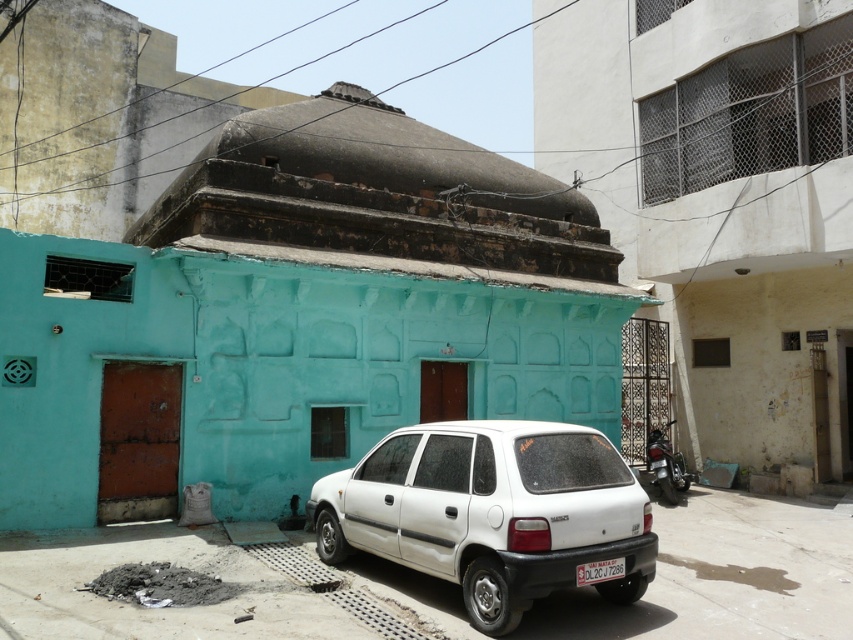
You are a delivery person who needs to park your vehicle in this area. You have a white matte hatchback at center and a shiny metallic motorcycle at right. Which vehicle is closer to the entrance of the turquoise building?

The white matte hatchback at center is closer to the entrance of the turquoise building because it is positioned in front of the shiny metallic motorcycle at right, which is farther away.

You are standing at the front of the turquoise building with a dome. You want to walk to the point marked at coordinates (491, 512). Which direction should you go?

The point at (491, 512) is located on the white matte hatchback at center, so you should walk towards the white matte hatchback at center to reach the point.

You are a delivery person who needs to park your shiny metallic motorcycle at right near the white plastic license plate at lower center. Can you safely move your motorcycle to the license plate without any obstacles?

The distance between the shiny metallic motorcycle at right and the white plastic license plate at lower center is 22.10 feet, so yes, you can safely move your motorcycle to the license plate without any obstacles.